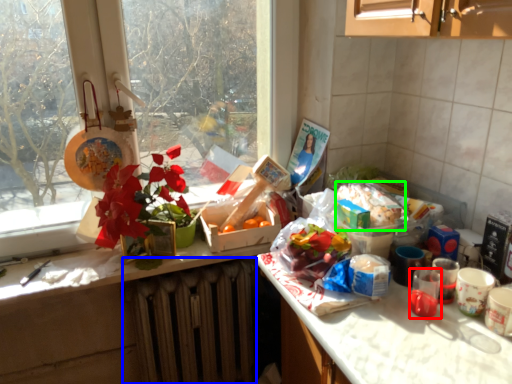
Question: Based on their relative distances, which object is nearer to coffee cup (highlighted by a red box)? Choose from radiator (highlighted by a blue box) and food (highlighted by a green box).

Choices:
 (A) radiator
 (B) food

Answer: (B)